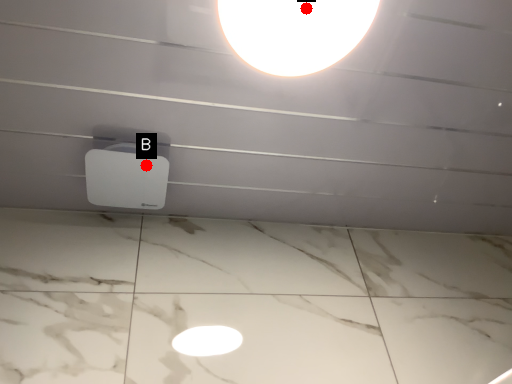
Question: Two points are circled on the image, labeled by A and B beside each circle. Which of the following is the farthest from the observer?

Choices:
 (A) A is further
 (B) B is further

Answer: (B)